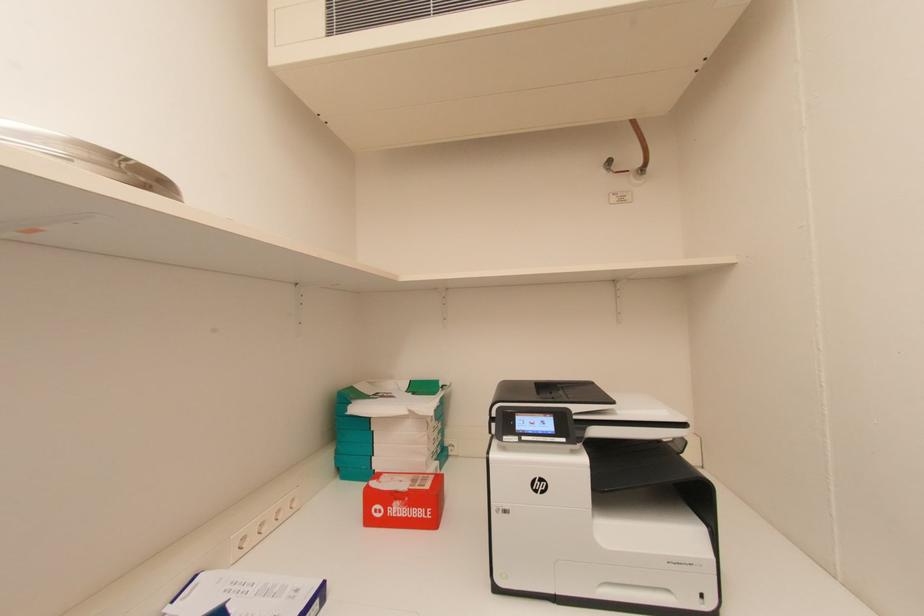
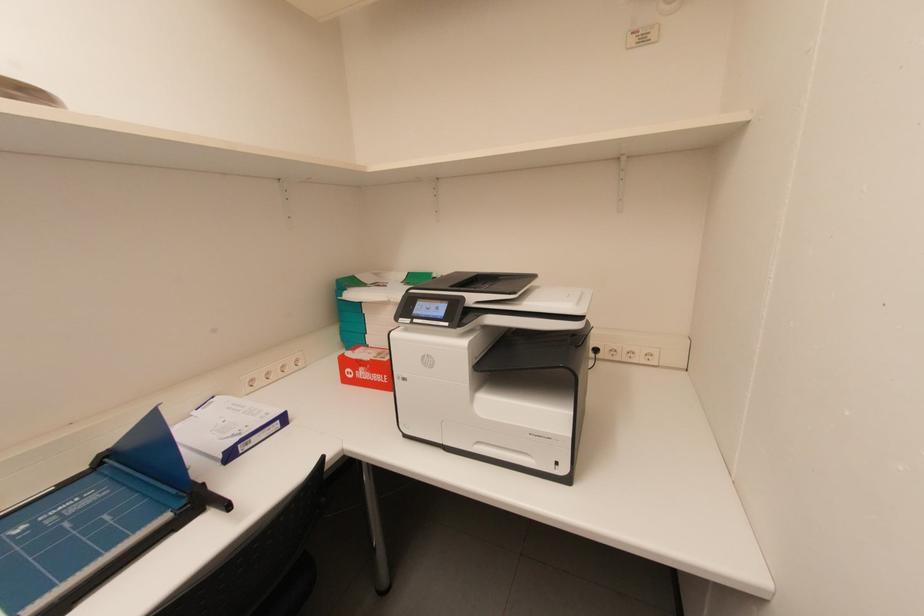
Question: In a continuous first-person perspective shot, in which direction is the camera moving?

Choices:
 (A) Left
 (B) Right
 (C) Forward
 (D) Backward

Answer: (B)